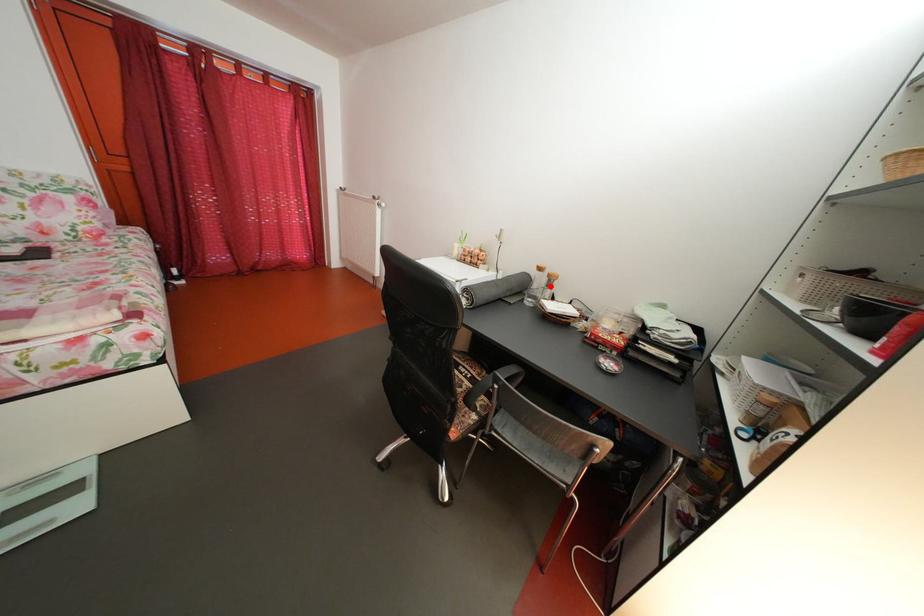
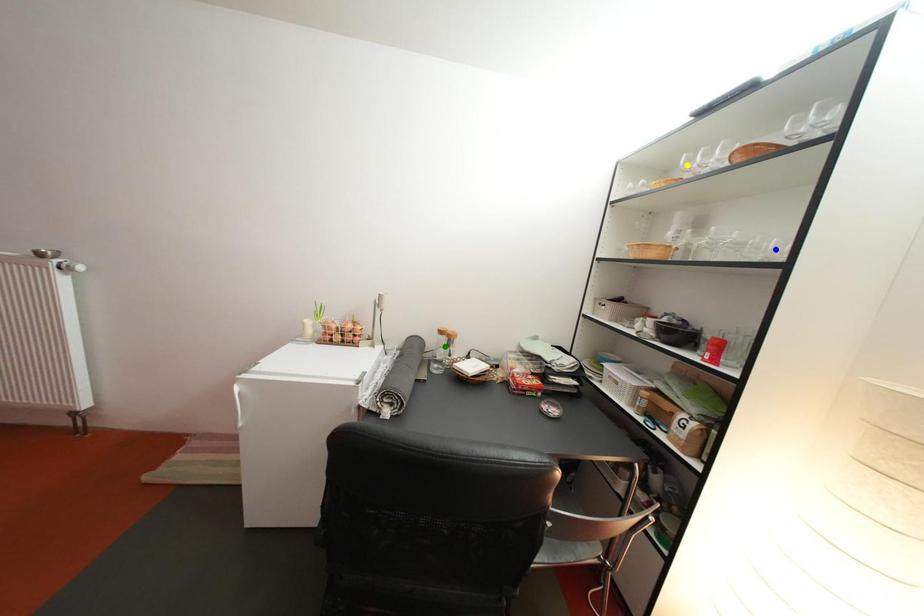
Question: I am providing you with two images of the same scene from different viewpoints. A red point is marked on the first image. You are given multiple points on the second image. Which point in image 2 is actually the same real-world point as the red point in image 1?

Choices:
 (A) yellow point
 (B) blue point
 (C) green point

Answer: (C)